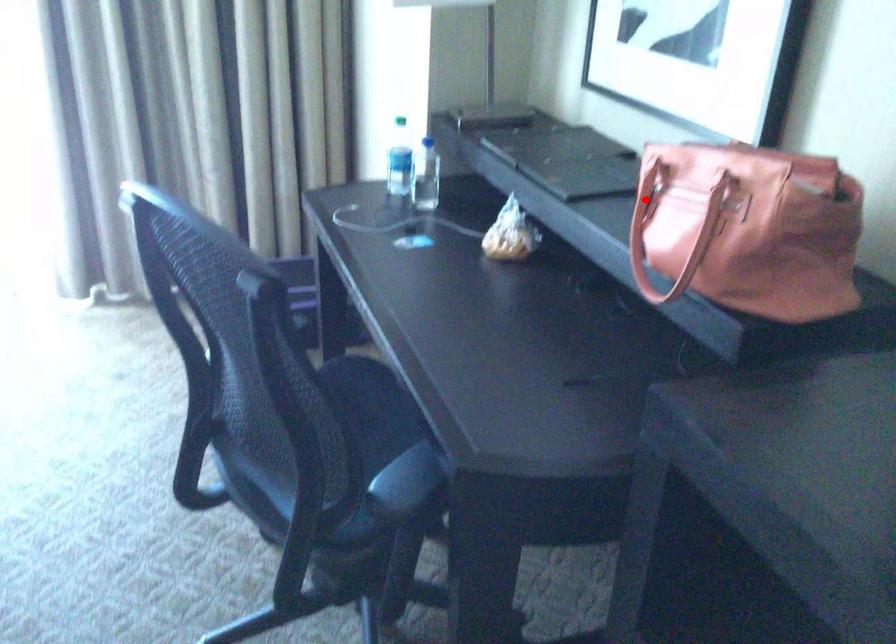
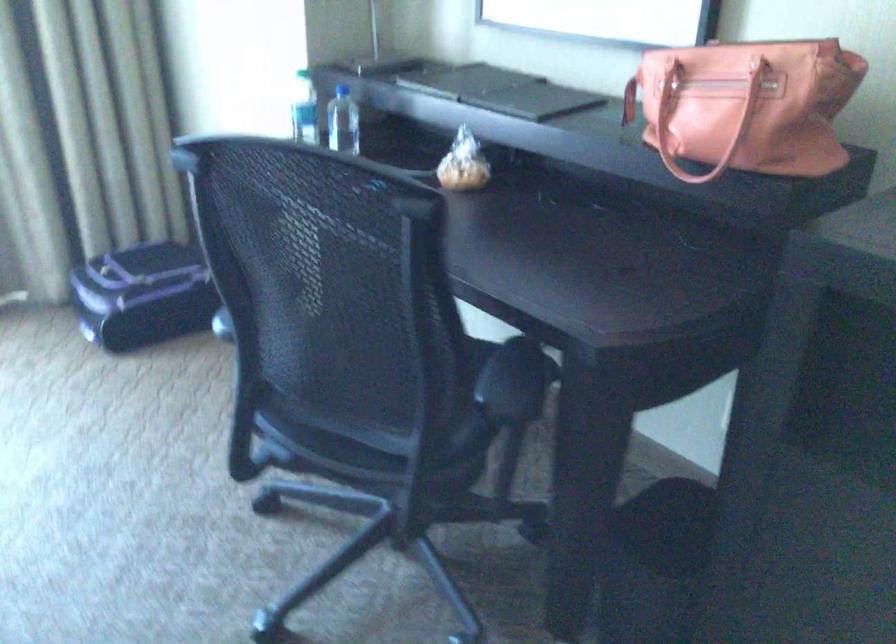
Question: A red point is marked in image1. In image2, is the corresponding 3D point closer to the camera or farther? Reply with the corresponding letter.

Choices:
 (A) The corresponding 3D point is closer.
 (B) The corresponding 3D point is farther.

Answer: (B)